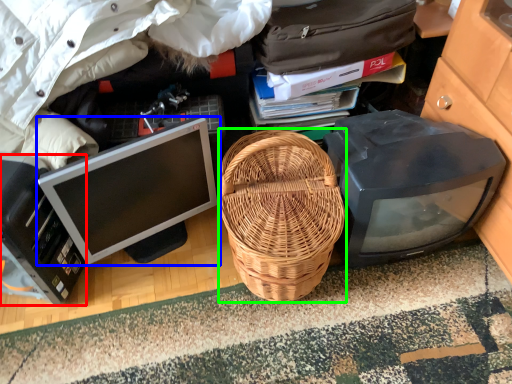
Question: Which object is positioned closest to computer (highlighted by a red box)? Select from computer monitor (highlighted by a blue box) and picnic basket (highlighted by a green box).

Choices:
 (A) computer monitor
 (B) picnic basket

Answer: (A)